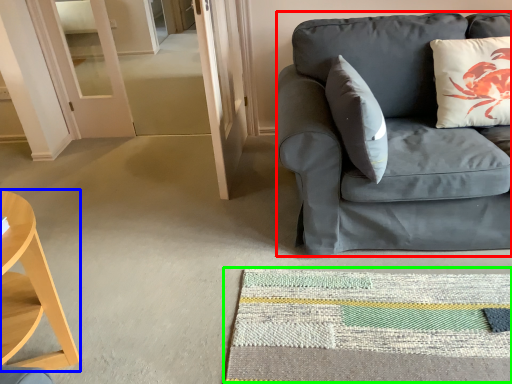
Question: Which object is the closest to the studio couch (highlighted by a red box)? Choose among these: desk (highlighted by a blue box) or mat (highlighted by a green box).

Choices:
 (A) desk
 (B) mat

Answer: (B)